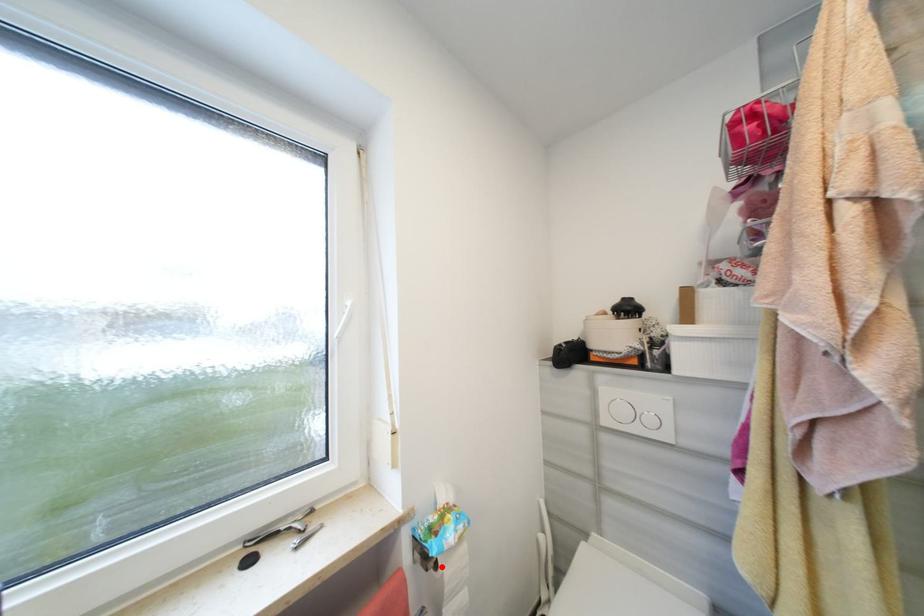
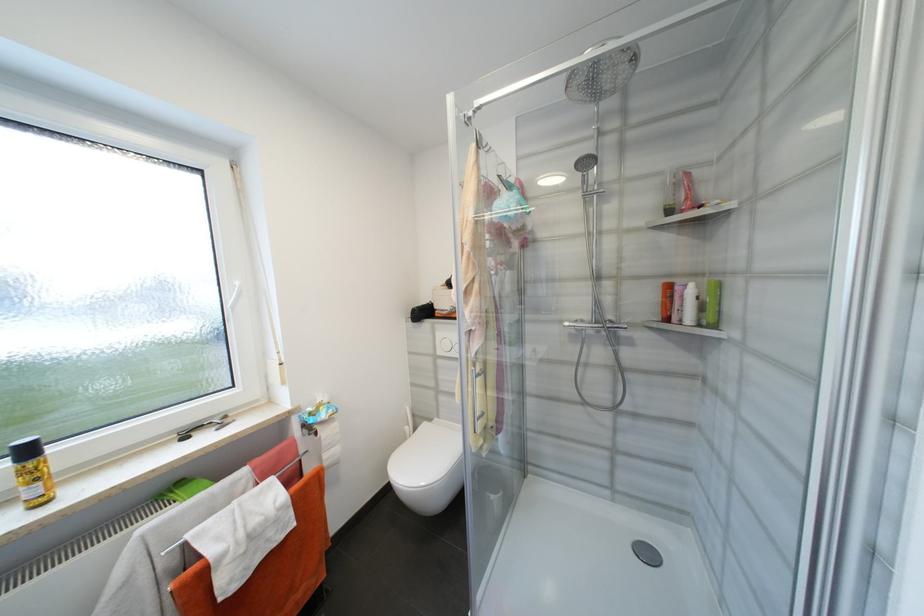
Question: I am providing you with two images of the same scene from different viewpoints. Given a red point in image1, look at the same physical point in image2. Is it:

Choices:
 (A) Closer to the viewpoint
 (B) Farther from the viewpoint

Answer: (A)